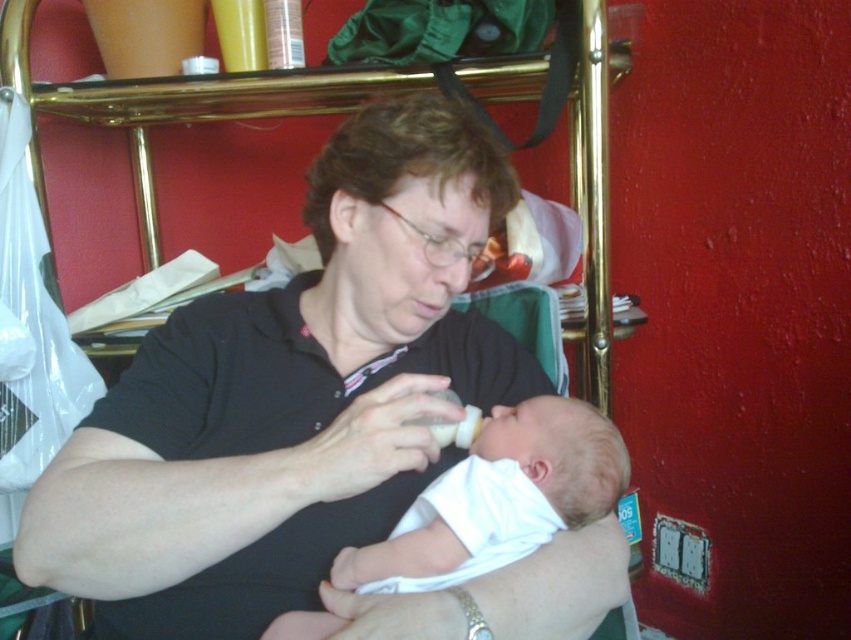
Is point (470, 580) positioned after point (421, 540)?

No, it is in front of (421, 540).

In the scene shown: Measure the distance from black matte shirt at center to white matte baby at center.

black matte shirt at center and white matte baby at center are 5.80 inches apart from each other.

At what (x,y) coordinates should I click in order to perform the action: click on black matte shirt at center. Please return your answer as a coordinate pair (x, y). Looking at the image, I should click on (313, 420).

The image size is (851, 640). In order to click on black matte shirt at center in this screenshot , I will do `click(313, 420)`.

What are the coordinates of `black matte shirt at center` in the screenshot? It's located at (313, 420).

The width and height of the screenshot is (851, 640). What are the coordinates of `black matte shirt at center` in the screenshot? It's located at (313, 420).

You are a GUI agent. You are given a task and a screenshot of the screen. Output one action in this format:
    pyautogui.click(x=<x>, y=<y>)
    Task: Click on the white matte baby at center
    Image resolution: width=851 pixels, height=640 pixels.
    Given the screenshot: What is the action you would take?
    pyautogui.click(x=498, y=499)

Does white matte baby at center appear on the left side of white matte baby bottle at center?

Yes, white matte baby at center is to the left of white matte baby bottle at center.

Between point (478, 444) and point (478, 426), which one is positioned behind?

The point (478, 426) is more distant.

Identify the location of white matte baby at center. Image resolution: width=851 pixels, height=640 pixels. (498, 499).